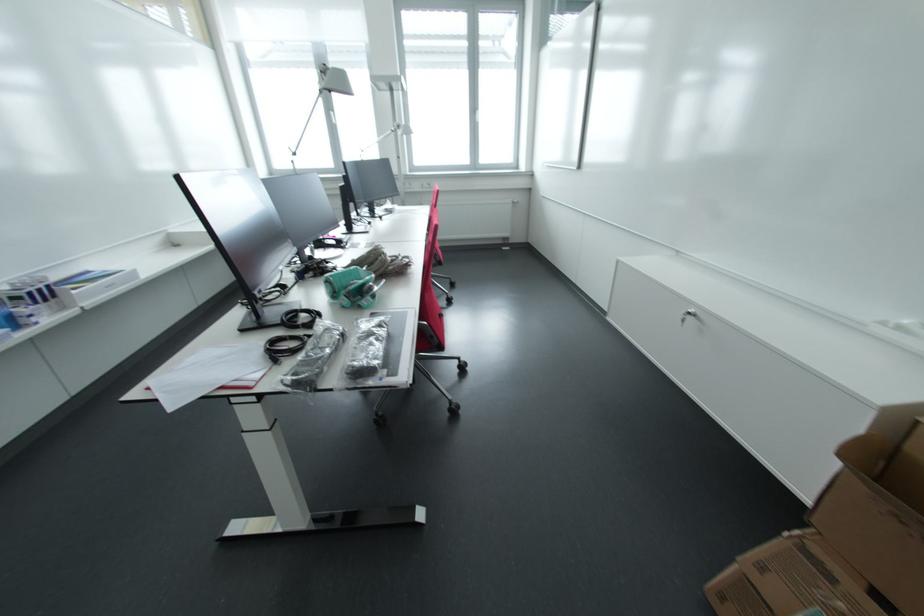
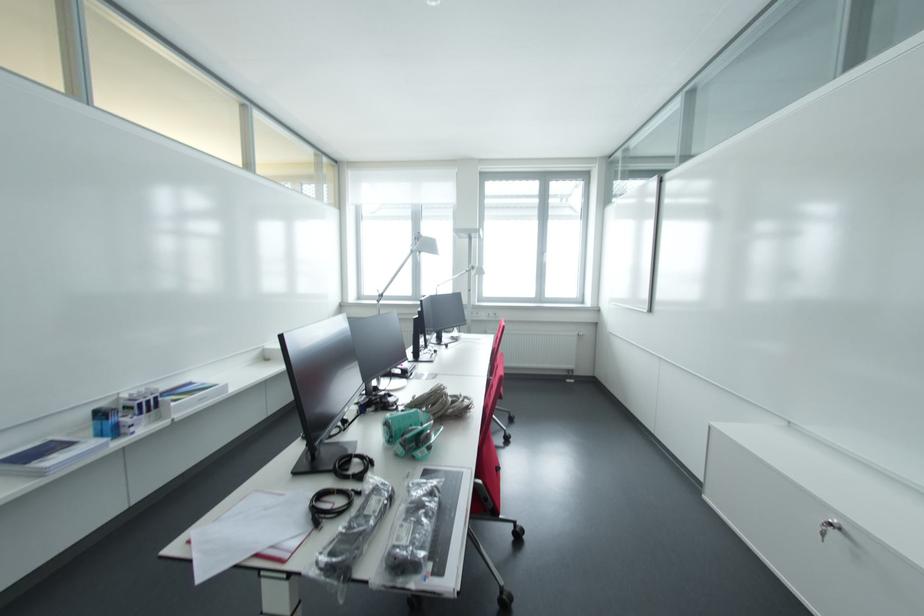
Where in the second image is the point corresponding to the point at 403,128 from the first image?

(476, 270)